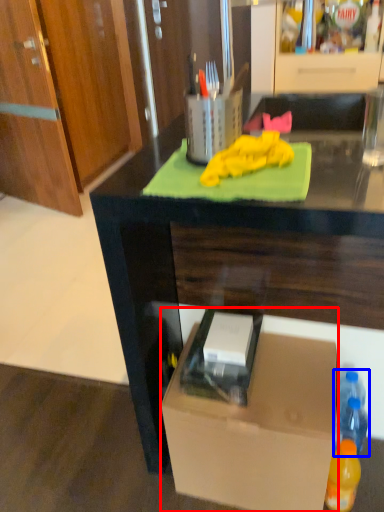
Question: Which object is further to the camera taking this photo, box (highlighted by a red box) or bottle (highlighted by a blue box)?

Choices:
 (A) box
 (B) bottle

Answer: (B)